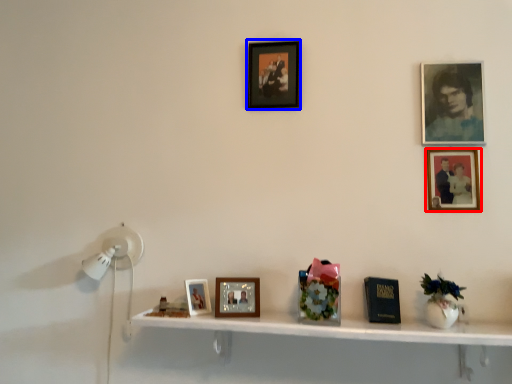
Question: Which point is closer to the camera, picture frame (highlighted by a red box) or picture frame (highlighted by a blue box)?

Choices:
 (A) picture frame
 (B) picture frame

Answer: (A)